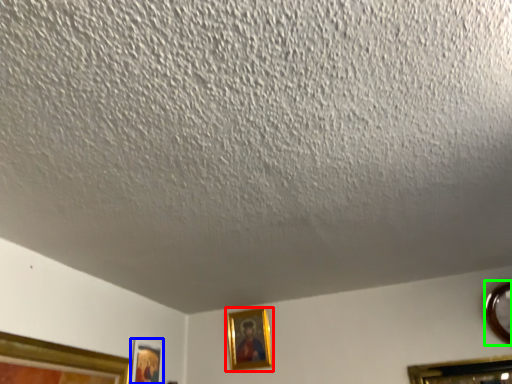
Question: Based on their relative distances, which object is farther from picture frame (highlighted by a red box)? Choose from picture frame (highlighted by a blue box) and picture frame (highlighted by a green box).

Choices:
 (A) picture frame
 (B) picture frame

Answer: (B)